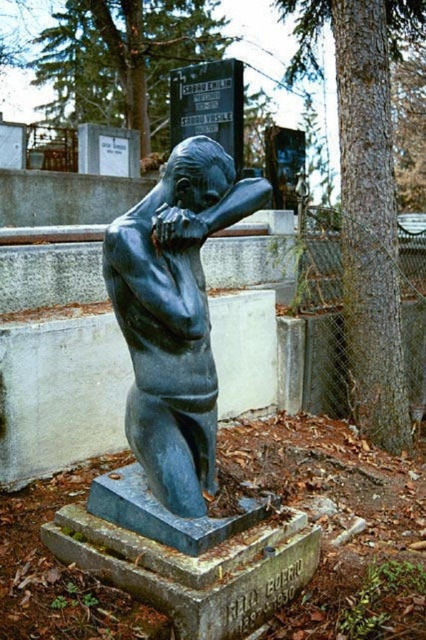
You are an archaeologist examining the statue and its surroundings. You notice the smooth brown bark at center. Where exactly is the smooth brown bark located in relation to the statue?

The smooth brown bark at center is located at point 0.308 on the x axis and 0.859 on the y axis.

You are a visitor at the cemetery and want to take a photo of the bronze statue at center and the smooth brown bark at center. Which object should you focus on first if you want the statue to appear to the left of the bark in your photo?

The bronze statue at center is positioned on the left side of the smooth brown bark at center. To have the statue appear to the left of the bark in your photo, focus on the bronze statue at center first as it is already positioned to the left of the smooth brown bark at center.